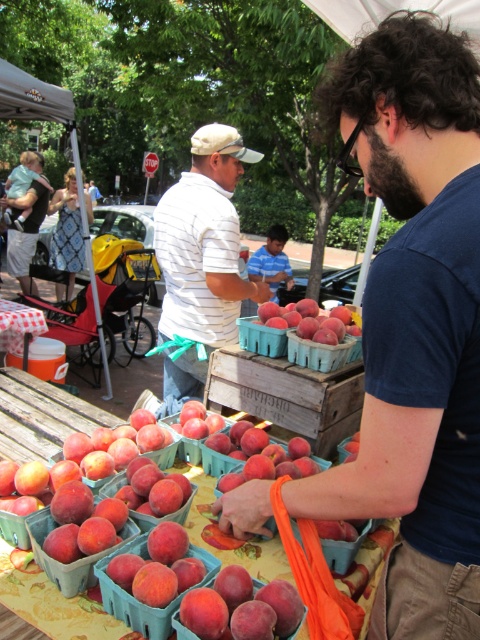
Between point (319, 339) and point (0, 336), which one is positioned in front?

Positioned in front is point (319, 339).

From the picture: Is peachy matte peaches at center bigger than plastic cup at lower left?

No, peachy matte peaches at center is not bigger than plastic cup at lower left.

Is point (317, 340) positioned behind point (24, 330)?

That is False.

Locate an element on the screen. Image resolution: width=480 pixels, height=640 pixels. peachy matte peaches at center is located at coordinates (310, 321).

Is white striped shirt at center taller than matte plastic peaches at center?

Yes.

Which is above, white striped shirt at center or matte plastic peaches at center?

white striped shirt at center is higher up.

Identify the location of white striped shirt at center. (202, 259).

Is white striped shirt at center above matte plastic basket at center?

Yes.

You are a GUI agent. You are given a task and a screenshot of the screen. Output one action in this format:
    pyautogui.click(x=<x>, y=<y>)
    Task: Click on the white striped shirt at center
    The width and height of the screenshot is (480, 640).
    Given the screenshot: What is the action you would take?
    pyautogui.click(x=202, y=259)

Where is `white striped shirt at center`? white striped shirt at center is located at coordinates (202, 259).